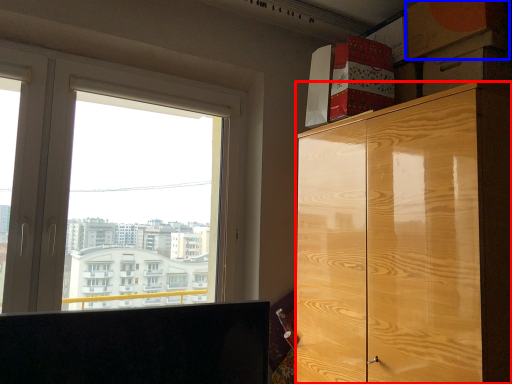
Question: Which object is closer to the camera taking this photo, cabinetry (highlighted by a red box) or cardboard box (highlighted by a blue box)?

Choices:
 (A) cabinetry
 (B) cardboard box

Answer: (A)